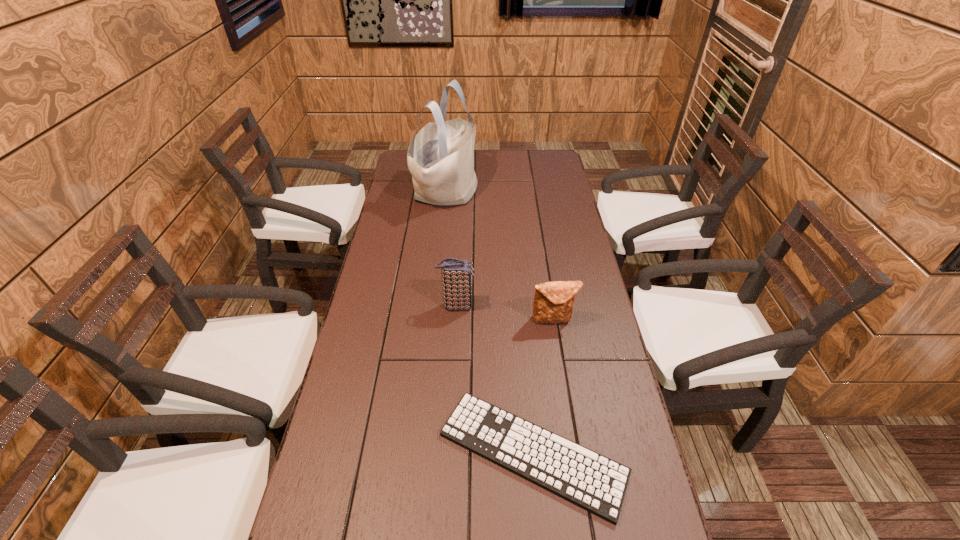
The image size is (960, 540). I want to click on free space located 0.260m on the open side of the shorter clutch bag, so click(x=567, y=408).

Identify the location of free space located 0.120m on the left of the nearest object. click(x=387, y=453).

Where is `object that is at the far edge`? This screenshot has height=540, width=960. object that is at the far edge is located at coordinates (440, 158).

At what (x,y) coordinates should I click in order to perform the action: click on object at the left edge. Please return your answer as a coordinate pair (x, y). This screenshot has width=960, height=540. Looking at the image, I should click on (440, 158).

In order to click on clutch bag located in the right edge section of the desktop in this screenshot , I will do `click(553, 303)`.

Where is `computer keyboard situated at the right edge`? The image size is (960, 540). computer keyboard situated at the right edge is located at coordinates (587, 479).

Identify the location of object that is positioned at the far left corner. (440, 158).

Locate an element on the screen. This screenshot has height=540, width=960. vacant space at the far edge is located at coordinates 521,164.

The width and height of the screenshot is (960, 540). I want to click on free space at the left edge of the desktop, so click(396, 408).

In the image, there is a desktop. Identify the location of vacant region at the right edge. (579, 246).